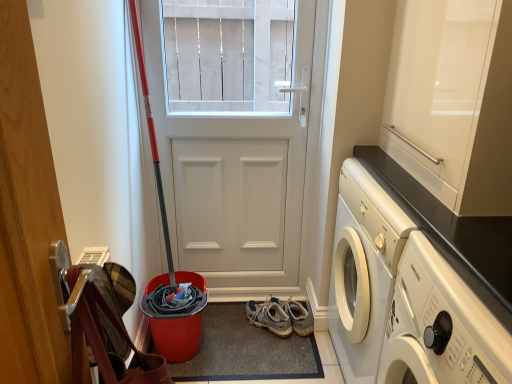
What are the coordinates of `blank area to the left of gray suede sneakers at lower center` in the screenshot? It's located at (232, 323).